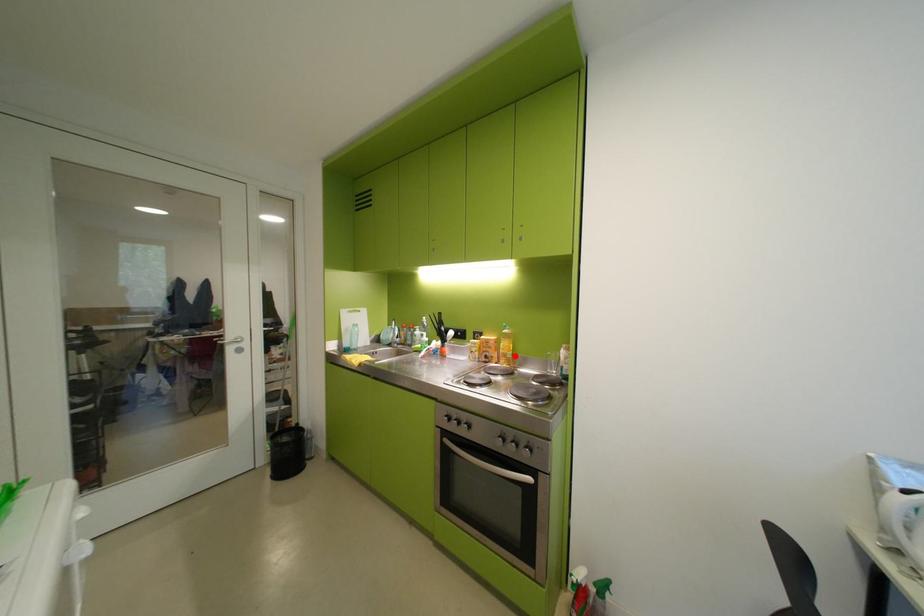
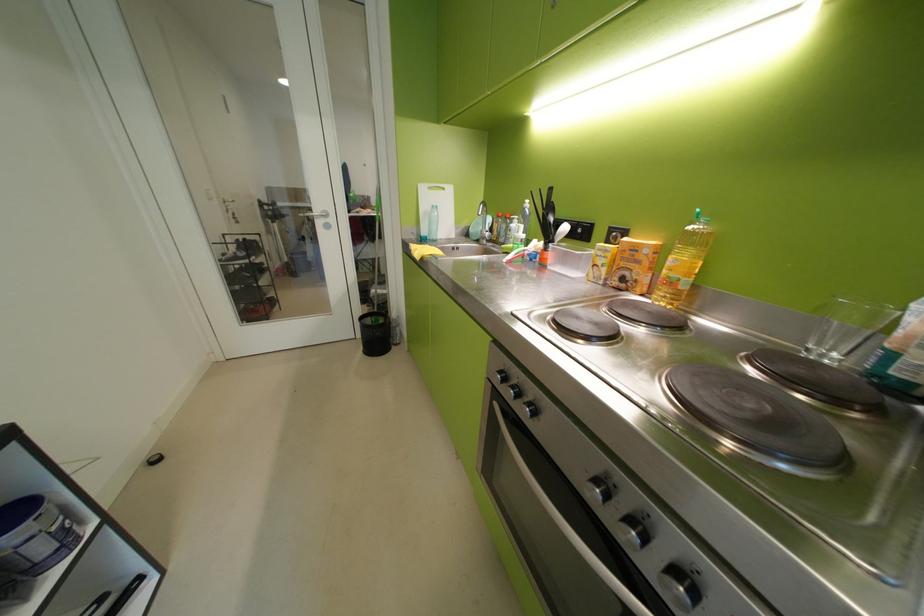
Locate, in the second image, the point that corresponds to the highlighted location in the first image.

(681, 284)